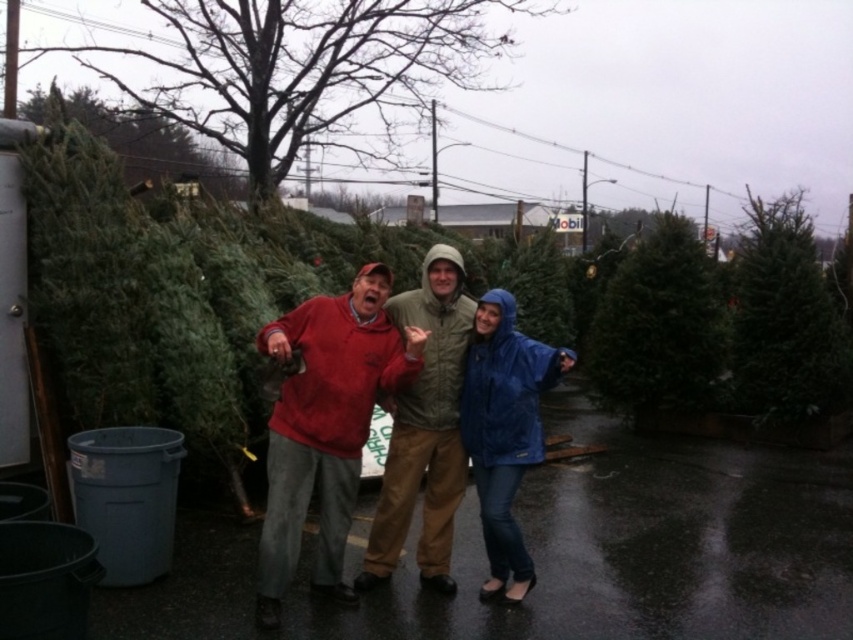
Question: Is the position of green textured pine tree at upper center more distant than that of matte red hoodie at center?

Choices:
 (A) no
 (B) yes

Answer: (B)

Question: Which point is farther to the camera?

Choices:
 (A) green matte christmas tree at right
 (B) matte red hoodie at center
 (C) green textured pine tree at upper center

Answer: (C)

Question: Which point is closer to the camera?

Choices:
 (A) blue waterproof jacket at center
 (B) green matte christmas tree at upper right
 (C) green matte christmas tree at right

Answer: (A)

Question: Does matte green jacket at center appear under green matte christmas tree at right?

Choices:
 (A) yes
 (B) no

Answer: (A)

Question: Which is farther from the green textured pine tree at upper center?

Choices:
 (A) matte green jacket at center
 (B) green matte christmas tree at right
 (C) green matte christmas tree at upper right
 (D) matte red hoodie at center

Answer: (A)

Question: Is green textured pine tree at upper center positioned before matte green jacket at center?

Choices:
 (A) no
 (B) yes

Answer: (A)